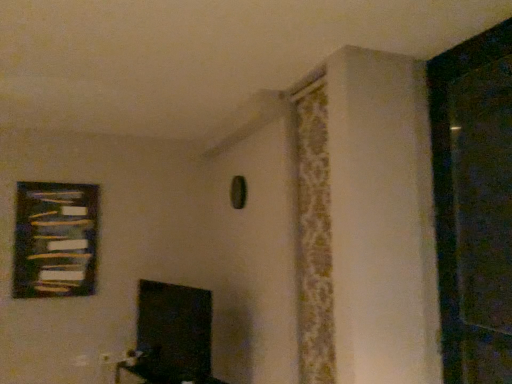
Question: Is black matte screen door at right directly adjacent to wooden frame at upper left?

Choices:
 (A) no
 (B) yes

Answer: (A)

Question: Is black matte screen door at right shorter than wooden frame at upper left?

Choices:
 (A) yes
 (B) no

Answer: (B)

Question: Is black matte screen door at right turned away from wooden frame at upper left?

Choices:
 (A) no
 (B) yes

Answer: (A)

Question: From the image's perspective, does black matte screen door at right appear lower than wooden frame at upper left?

Choices:
 (A) no
 (B) yes

Answer: (A)

Question: Does black matte screen door at right have a greater height compared to wooden frame at upper left?

Choices:
 (A) yes
 (B) no

Answer: (A)

Question: Would you say matte black tv at lower center is to the left or to the right of wooden frame at upper left in the picture?

Choices:
 (A) left
 (B) right

Answer: (B)

Question: Is matte black tv at lower center bigger or smaller than wooden frame at upper left?

Choices:
 (A) small
 (B) big

Answer: (B)

Question: Do you think matte black tv at lower center is within wooden frame at upper left, or outside of it?

Choices:
 (A) inside
 (B) outside

Answer: (B)

Question: From the image's perspective, is matte black tv at lower center located above or below wooden frame at upper left?

Choices:
 (A) above
 (B) below

Answer: (B)

Question: Is point (314, 81) positioned closer to the camera than point (495, 170)?

Choices:
 (A) closer
 (B) farther

Answer: (B)

Question: Would you say patterned fabric curtain at upper right is to the left or to the right of black matte screen door at right in the picture?

Choices:
 (A) right
 (B) left

Answer: (B)

Question: Would you say patterned fabric curtain at upper right is inside or outside black matte screen door at right?

Choices:
 (A) inside
 (B) outside

Answer: (B)

Question: From their relative heights in the image, would you say patterned fabric curtain at upper right is taller or shorter than black matte screen door at right?

Choices:
 (A) tall
 (B) short

Answer: (A)

Question: Considering the positions of point (18, 210) and point (138, 365), is point (18, 210) closer or farther from the camera than point (138, 365)?

Choices:
 (A) farther
 (B) closer

Answer: (A)

Question: Looking at their shapes, would you say wooden frame at upper left is wider or thinner than matte black tv at lower center?

Choices:
 (A) wide
 (B) thin

Answer: (B)